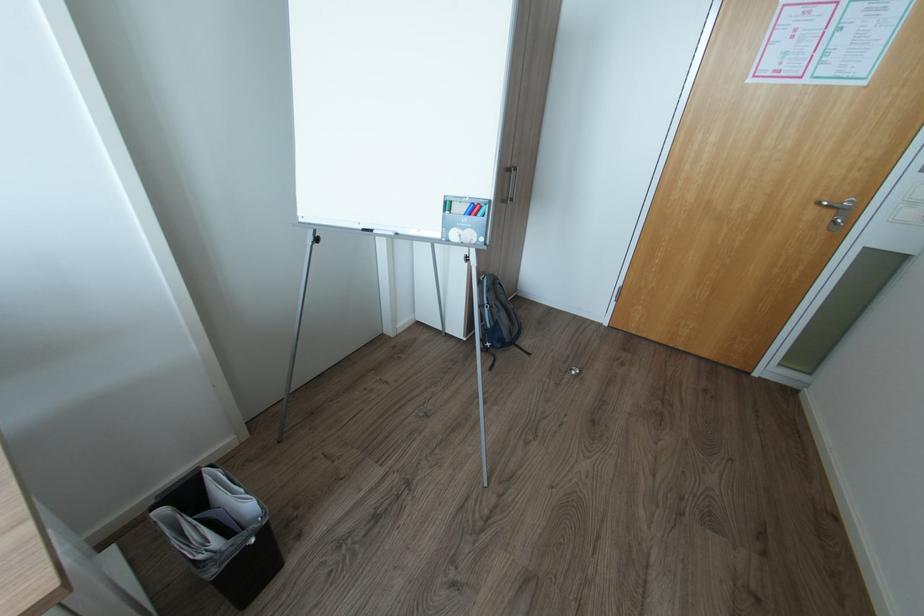
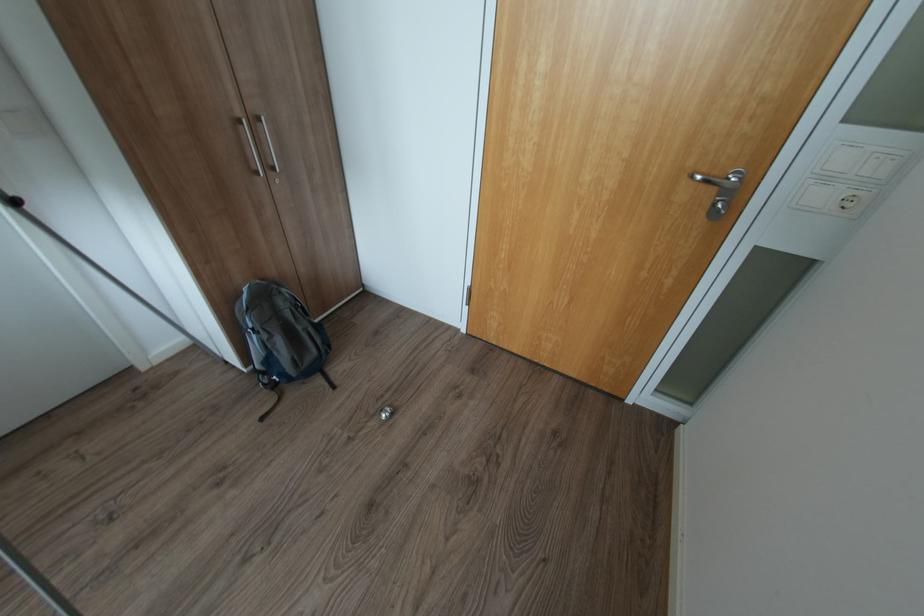
In a continuous first-person perspective shot, in which direction is the camera moving?

The cameraman walked toward right, forward.